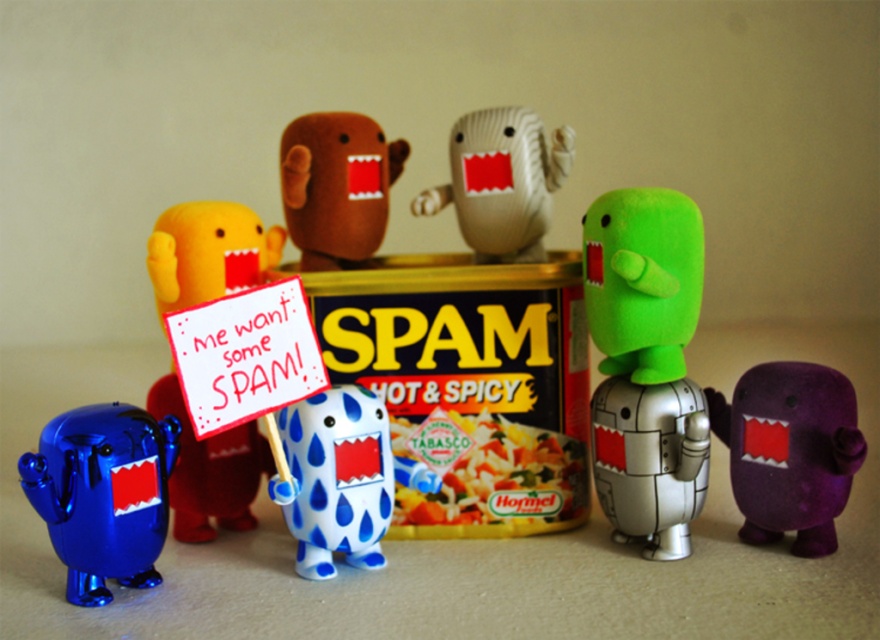
You are a child trying to reach the yellow plush toy at center from where you are standing. The metallic blue robot at lower left is blocking your path. Can you move the robot to get to the toy?

The metallic blue robot at lower left is positioned under the yellow plush toy at center, so moving the robot might not be necessary as the toy is above it. You can reach the yellow plush toy at center by going around the metallic blue robot at lower left.

You are trying to place both the metallic blue robot at lower left and the purple felt toy at right on a shelf that can only hold items narrower than 15 cm. Which one can fit on the shelf?

The metallic blue robot at lower left has a width less than the purple felt toy at right, so the metallic blue robot at lower left can fit on the shelf if its width is under 15 cm, but the purple felt toy at right might not fit.

You are a child trying to reach the purple felt toy at right from where you are standing next to the metallic blue robot at lower left. Can you easily grab it without moving the robot?

The metallic blue robot at lower left is positioned under the purple felt toy at right, so the purple felt toy is above the robot. Since the robot is in the way, you cannot easily grab the purple felt toy at right without moving the metallic blue robot at lower left.